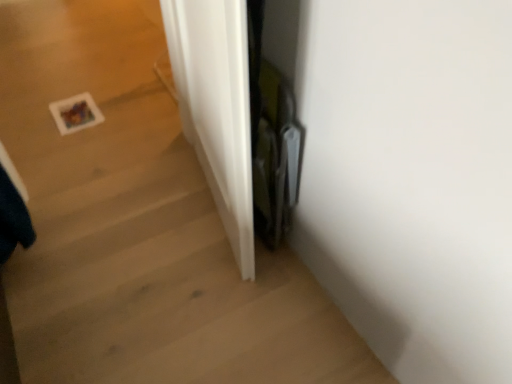
This screenshot has height=384, width=512. Identify the location of black glossy screen door at center. (272, 138).

The width and height of the screenshot is (512, 384). What do you see at coordinates (272, 138) in the screenshot?
I see `black glossy screen door at center` at bounding box center [272, 138].

In order to click on black glossy screen door at center in this screenshot , I will do pos(272,138).